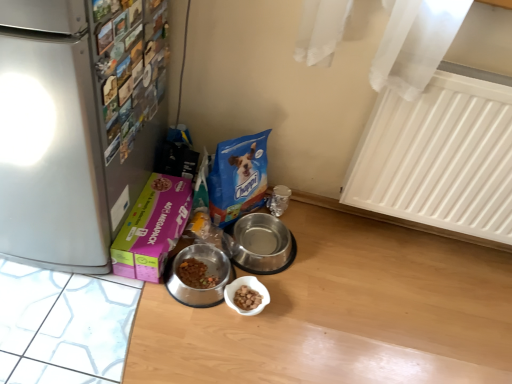
The width and height of the screenshot is (512, 384). What do you see at coordinates (207, 274) in the screenshot? I see `metallic stainless steel bowl at center, arranged as the 2th appliance when viewed from the right` at bounding box center [207, 274].

Measure the distance between point (251,234) and camera.

Point (251,234) and camera are 6.83 feet apart from each other.

Measure the distance between silver metallic bowl at center, acting as the first appliance starting from the right, and camera.

The depth of silver metallic bowl at center, acting as the first appliance starting from the right, is 1.57 meters.

At what (x,y) coordinates should I click in order to perform the action: click on metallic stainless steel bowl at center, arranged as the 2th appliance when viewed from the right. Please return your answer as a coordinate pair (x, y). Image resolution: width=512 pixels, height=384 pixels. Looking at the image, I should click on (207, 274).

From a real-world perspective, is satin silver refrigerator at left physically located above or below pink cardboard box at lower left?

In terms of real-world spatial position, satin silver refrigerator at left is above pink cardboard box at lower left.

Is pink cardboard box at lower left at the back of satin silver refrigerator at left?

No.

Is satin silver refrigerator at left thinner than pink cardboard box at lower left?

In fact, satin silver refrigerator at left might be wider than pink cardboard box at lower left.

Can you confirm if satin silver refrigerator at left is smaller than pink cardboard box at lower left?

Actually, satin silver refrigerator at left might be larger than pink cardboard box at lower left.

From a real-world perspective, is pink cardboard box at lower left over satin silver refrigerator at left?

Actually, pink cardboard box at lower left is physically below satin silver refrigerator at left in the real world.

Which of these two, pink cardboard box at lower left or satin silver refrigerator at left, is wider?

satin silver refrigerator at left.

Locate an element on the screen. The height and width of the screenshot is (384, 512). box to the right of satin silver refrigerator at left is located at coordinates (152, 228).

Considering the sizes of objects white plastic radiator at upper right and metallic stainless steel bowl at center, arranged as the 2th appliance when viewed from the right, in the image provided, who is thinner, white plastic radiator at upper right or metallic stainless steel bowl at center, arranged as the 2th appliance when viewed from the right,?

white plastic radiator at upper right is thinner.

Does point (453, 137) come closer to viewer compared to point (184, 257)?

Yes, point (453, 137) is closer to viewer.

Is the depth of white plastic radiator at upper right greater than that of metallic stainless steel bowl at center, which is the first appliance in left-to-right order?

No.

Is white plastic radiator at upper right inside or outside of metallic stainless steel bowl at center, which is the first appliance in left-to-right order?

white plastic radiator at upper right lies outside metallic stainless steel bowl at center, which is the first appliance in left-to-right order.

Which point is more forward, (x=170, y=198) or (x=243, y=249)?

The point (x=170, y=198) is in front.

Is pink cardboard box at lower left far away from silver metallic bowl at center, acting as the first appliance starting from the right?

They are positioned close to each other.

Between pink cardboard box at lower left and silver metallic bowl at center, acting as the first appliance starting from the right, which one has smaller width?

Thinner between the two is silver metallic bowl at center, acting as the first appliance starting from the right.

In the scene shown: From the image's perspective, is pink cardboard box at lower left positioned above or below silver metallic bowl at center, acting as the first appliance starting from the right?

pink cardboard box at lower left is above silver metallic bowl at center, acting as the first appliance starting from the right.

From the picture: Considering the positions of objects metallic stainless steel bowl at center, which is the first appliance in left-to-right order, and silver metallic bowl at center, the 2th appliance from the left, in the image provided, who is in front, metallic stainless steel bowl at center, which is the first appliance in left-to-right order, or silver metallic bowl at center, the 2th appliance from the left,?

Positioned in front is metallic stainless steel bowl at center, which is the first appliance in left-to-right order.

From a real-world perspective, between metallic stainless steel bowl at center, which is the first appliance in left-to-right order, and silver metallic bowl at center, the 2th appliance from the left, who is vertically higher?

From a 3D spatial view, silver metallic bowl at center, the 2th appliance from the left, is above.

Is point (179, 300) positioned in front of point (236, 245)?

Yes, it is in front of point (236, 245).

Can you tell me how much white plastic radiator at upper right and satin silver refrigerator at left differ in facing direction?

white plastic radiator at upper right and satin silver refrigerator at left are facing 0.0682 degrees away from each other.

In the scene shown: Can you confirm if white plastic radiator at upper right is positioned to the right of satin silver refrigerator at left?

Correct, you'll find white plastic radiator at upper right to the right of satin silver refrigerator at left.

Identify the location of refrigerator on the left of white plastic radiator at upper right. (77, 124).

From a real-world perspective, which object stands above the other?

satin silver refrigerator at left, from a real-world perspective.

Is silver metallic bowl at center, acting as the first appliance starting from the right, located outside satin silver refrigerator at left?

Yes, silver metallic bowl at center, acting as the first appliance starting from the right, is located beyond the bounds of satin silver refrigerator at left.

From the image's perspective, is silver metallic bowl at center, acting as the first appliance starting from the right, on satin silver refrigerator at left?

No, from the image's perspective, silver metallic bowl at center, acting as the first appliance starting from the right, is not above satin silver refrigerator at left.

Does point (276, 251) appear closer or farther from the camera than point (136, 34)?

Point (276, 251) is positioned farther from the camera compared to point (136, 34).

Identify the location of box located underneath the satin silver refrigerator at left (from a real-world perspective). The height and width of the screenshot is (384, 512). (152, 228).

Identify the location of refrigerator positioned vertically above the pink cardboard box at lower left (from a real-world perspective). The image size is (512, 384). (77, 124).

Based on their spatial positions, is metallic stainless steel bowl at center, which is the first appliance in left-to-right order, or silver metallic bowl at center, acting as the first appliance starting from the right, closer to satin silver refrigerator at left?

The object closer to satin silver refrigerator at left is metallic stainless steel bowl at center, which is the first appliance in left-to-right order.

Estimate the real-world distances between objects in this image. Which object is further from white plastic radiator at upper right, satin silver refrigerator at left or silver metallic bowl at center, acting as the first appliance starting from the right?

satin silver refrigerator at left is further to white plastic radiator at upper right.

Estimate the real-world distances between objects in this image. Which object is further from white plastic radiator at upper right, metallic stainless steel bowl at center, which is the first appliance in left-to-right order, or pink cardboard box at lower left?

Based on the image, pink cardboard box at lower left appears to be further to white plastic radiator at upper right.

Based on the photo, which object lies further to the anchor point silver metallic bowl at center, acting as the first appliance starting from the right, white plastic radiator at upper right or metallic stainless steel bowl at center, arranged as the 2th appliance when viewed from the right?

Among the two, white plastic radiator at upper right is located further to silver metallic bowl at center, acting as the first appliance starting from the right.

Considering their positions, is satin silver refrigerator at left positioned further to metallic stainless steel bowl at center, arranged as the 2th appliance when viewed from the right, than silver metallic bowl at center, acting as the first appliance starting from the right?

satin silver refrigerator at left.

Looking at the image, which one is located closer to satin silver refrigerator at left, metallic stainless steel bowl at center, arranged as the 2th appliance when viewed from the right, or white plastic radiator at upper right?

Based on the image, metallic stainless steel bowl at center, arranged as the 2th appliance when viewed from the right, appears to be nearer to satin silver refrigerator at left.

Looking at this image, from the image, which object appears to be nearer to silver metallic bowl at center, acting as the first appliance starting from the right, pink cardboard box at lower left or white plastic radiator at upper right?

The object closer to silver metallic bowl at center, acting as the first appliance starting from the right, is pink cardboard box at lower left.

Considering their positions, is white plastic radiator at upper right positioned closer to pink cardboard box at lower left than silver metallic bowl at center, the 2th appliance from the left?

silver metallic bowl at center, the 2th appliance from the left, lies closer to pink cardboard box at lower left than the other object.

The width and height of the screenshot is (512, 384). I want to click on appliance located between satin silver refrigerator at left and silver metallic bowl at center, acting as the first appliance starting from the right, in the depth direction, so click(207, 274).

Locate an element on the screen. This screenshot has height=384, width=512. box between satin silver refrigerator at left and silver metallic bowl at center, acting as the first appliance starting from the right, along the z-axis is located at coordinates (152, 228).

Identify the location of box located between satin silver refrigerator at left and metallic stainless steel bowl at center, arranged as the 2th appliance when viewed from the right, in the depth direction. (152, 228).

Where is `appliance between pink cardboard box at lower left and silver metallic bowl at center, the 2th appliance from the left`? Image resolution: width=512 pixels, height=384 pixels. appliance between pink cardboard box at lower left and silver metallic bowl at center, the 2th appliance from the left is located at coordinates point(207,274).